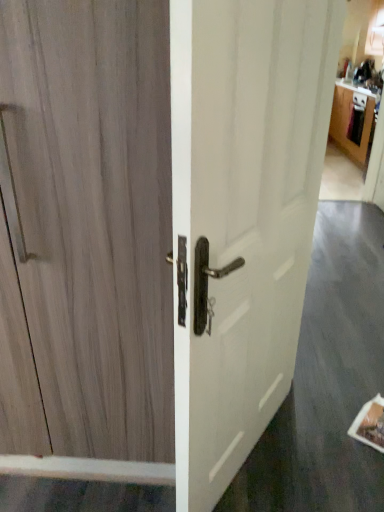
Question: Based on their positions, is light brown wood door at left located to the left or right of wooden cabinet at upper right?

Choices:
 (A) right
 (B) left

Answer: (B)

Question: From the image's perspective, is light brown wood door at left positioned above or below wooden cabinet at upper right?

Choices:
 (A) above
 (B) below

Answer: (B)

Question: Which object is positioned closest to the white glossy door handle at center?

Choices:
 (A) light brown wood door at left
 (B) wooden cabinet at upper right

Answer: (A)

Question: Estimate the real-world distances between objects in this image. Which object is closer to the light brown wood door at left?

Choices:
 (A) wooden cabinet at upper right
 (B) white glossy door handle at center

Answer: (B)